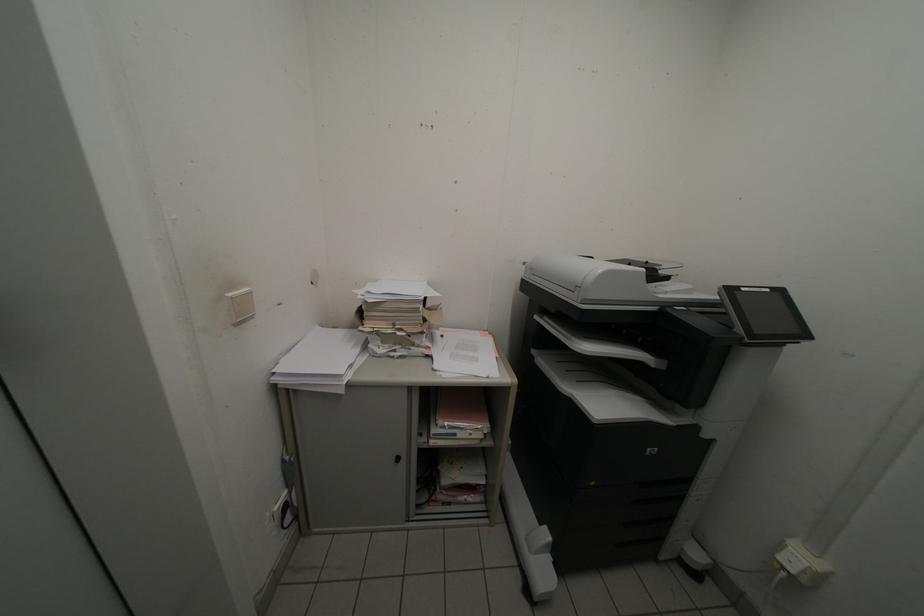
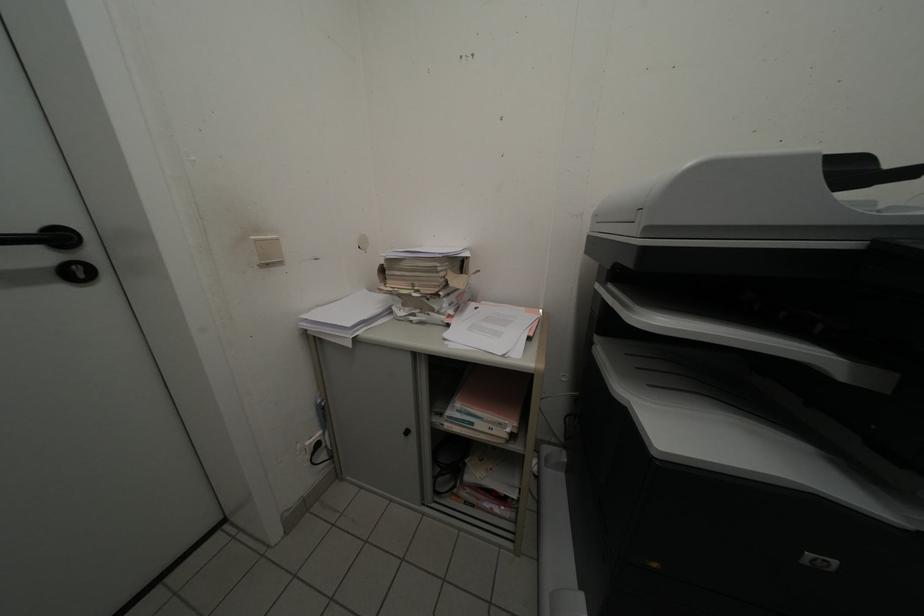
Question: Based on the continuous images, in which direction is the camera rotating? Reply with the corresponding letter.

Choices:
 (A) Left
 (B) Right
 (C) Up
 (D) Down

Answer: (A)